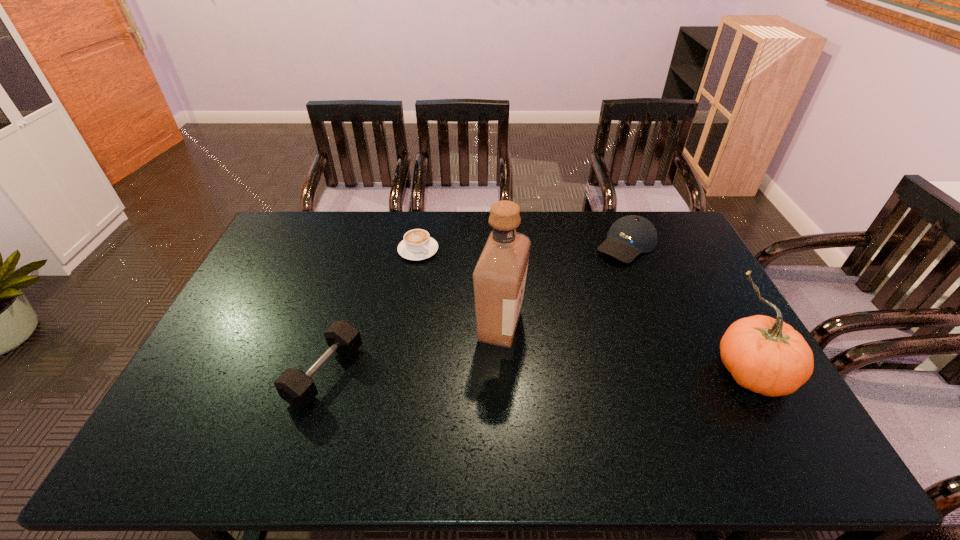
Where is `vacant space at the far left corner of the desktop`? vacant space at the far left corner of the desktop is located at coordinates (276, 243).

At what (x,y) coordinates should I click in order to perform the action: click on vacant area that lies between the third object from right to left and the leftmost object. Please return your answer as a coordinate pair (x, y). Looking at the image, I should click on (413, 349).

This screenshot has height=540, width=960. What are the coordinates of `free point between the shortest object and the leftmost object` in the screenshot? It's located at (372, 312).

You are a GUI agent. You are given a task and a screenshot of the screen. Output one action in this format:
    pyautogui.click(x=<x>, y=<y>)
    Task: Click on the free space between the baseball cap and the pumpkin
    This screenshot has width=960, height=540.
    Given the screenshot: What is the action you would take?
    pyautogui.click(x=689, y=309)

Identify the location of free point between the baseball cap and the second tallest object. (689, 309).

At what (x,y) coordinates should I click in order to perform the action: click on vacant area that lies between the cappuccino and the dumbbell. Please return your answer as a coordinate pair (x, y). The image size is (960, 540). Looking at the image, I should click on (372, 312).

Find the location of a particular element. vacant space in between the shortest object and the leftmost object is located at coordinates (372, 312).

Locate an element on the screen. The height and width of the screenshot is (540, 960). object that stands as the second closest to the baseball cap is located at coordinates (765, 355).

This screenshot has height=540, width=960. I want to click on the fourth closest object to the third object from right to left, so click(765, 355).

This screenshot has height=540, width=960. I want to click on free space that satisfies the following two spatial constraints: 1. on the front side of the fourth shortest object; 2. on the left side of the liquor, so click(502, 373).